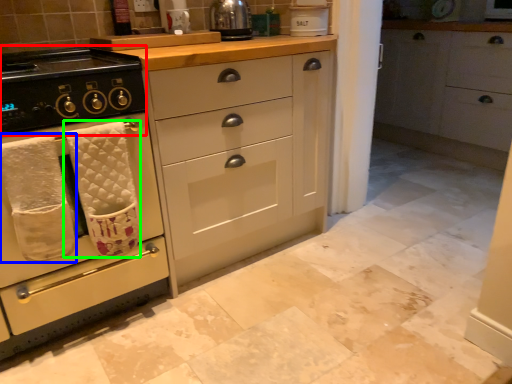
Question: Based on their relative distances, which object is farther from gas stove (highlighted by a red box)? Choose from bath towel (highlighted by a blue box) and bath towel (highlighted by a green box).

Choices:
 (A) bath towel
 (B) bath towel

Answer: (A)